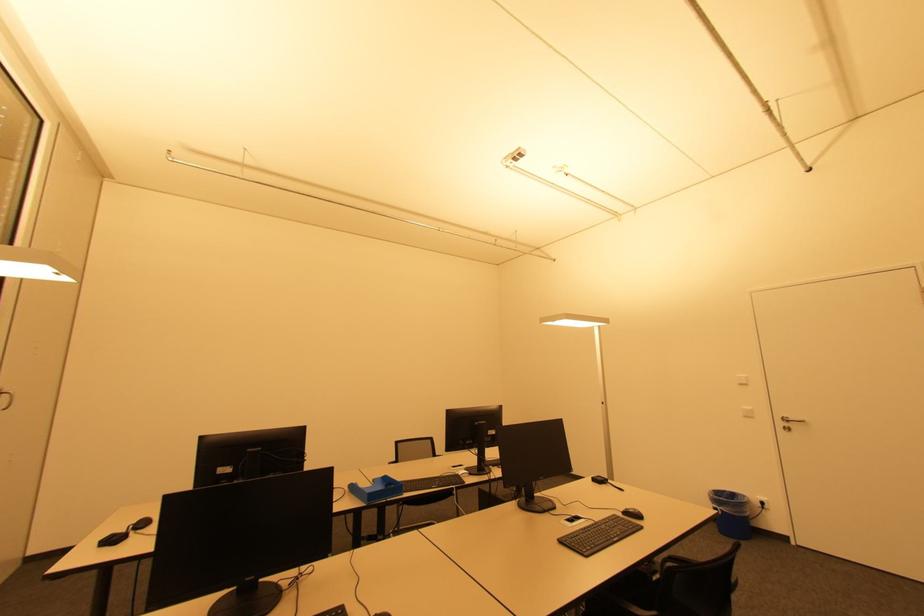
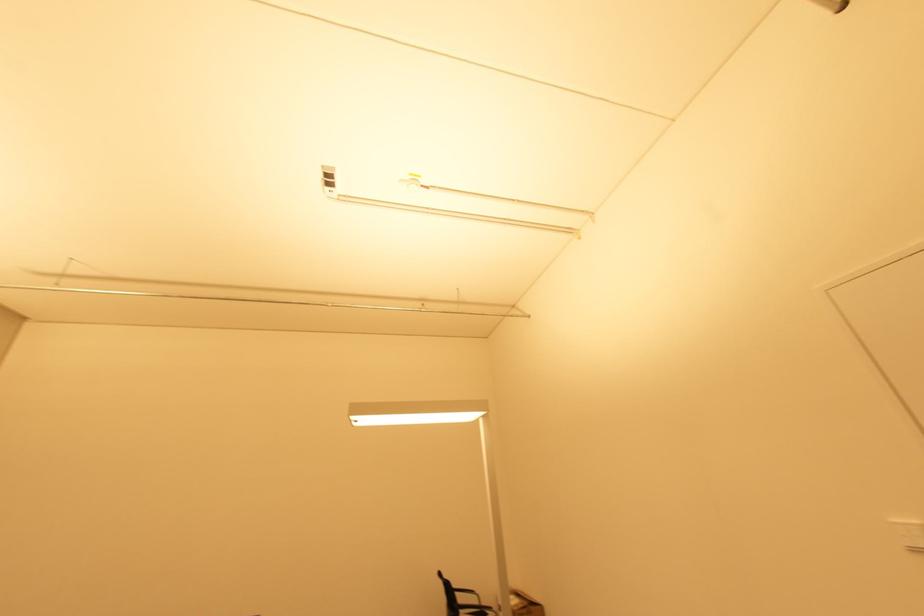
In a continuous first-person perspective shot, in which direction is the camera moving?

The cameraman walked toward right, forward.